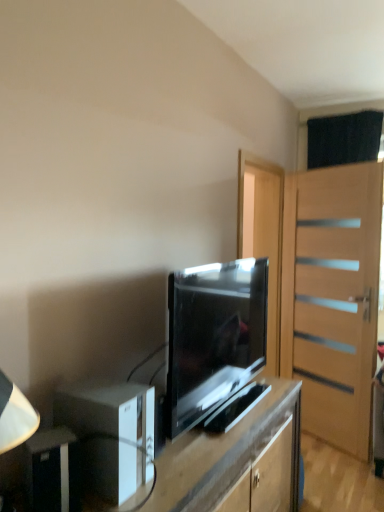
Question: Does black plastic speaker at lower left, arranged as the second appliance when viewed from the back, turn towards matte black tv stand at center?

Choices:
 (A) yes
 (B) no

Answer: (B)

Question: From the image's perspective, is black plastic speaker at lower left, the first appliance viewed from the front, over matte black tv stand at center?

Choices:
 (A) yes
 (B) no

Answer: (A)

Question: Does black plastic speaker at lower left, the first appliance viewed from the front, have a larger size compared to matte black tv stand at center?

Choices:
 (A) yes
 (B) no

Answer: (B)

Question: Is black plastic speaker at lower left, arranged as the second appliance when viewed from the back, at the left side of matte black tv stand at center?

Choices:
 (A) yes
 (B) no

Answer: (A)

Question: Can you confirm if black plastic speaker at lower left, arranged as the second appliance when viewed from the back, is taller than matte black tv stand at center?

Choices:
 (A) yes
 (B) no

Answer: (B)

Question: Is black plastic speaker at lower left, arranged as the second appliance when viewed from the back, thinner than matte black tv stand at center?

Choices:
 (A) yes
 (B) no

Answer: (A)

Question: Does matte black tv stand at center lie behind matte black tv at center?

Choices:
 (A) yes
 (B) no

Answer: (B)

Question: Can you confirm if matte black tv stand at center is wider than matte black tv at center?

Choices:
 (A) yes
 (B) no

Answer: (A)

Question: Can you confirm if matte black tv stand at center is taller than matte black tv at center?

Choices:
 (A) no
 (B) yes

Answer: (B)

Question: Considering the relative positions of matte black tv stand at center and matte black tv at center in the image provided, is matte black tv stand at center to the left of matte black tv at center from the viewer's perspective?

Choices:
 (A) no
 (B) yes

Answer: (B)

Question: Is matte black tv at center inside matte black tv stand at center?

Choices:
 (A) yes
 (B) no

Answer: (B)

Question: Considering the relative sizes of matte black tv stand at center and matte black tv at center in the image provided, is matte black tv stand at center smaller than matte black tv at center?

Choices:
 (A) yes
 (B) no

Answer: (B)

Question: From the image's perspective, is light brown wooden door at right on matte black tv at center?

Choices:
 (A) yes
 (B) no

Answer: (B)